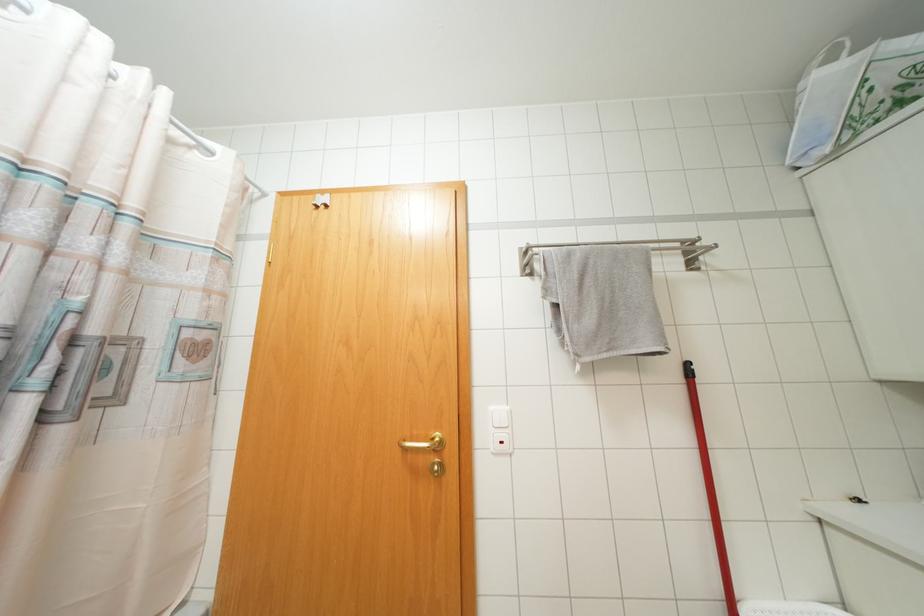
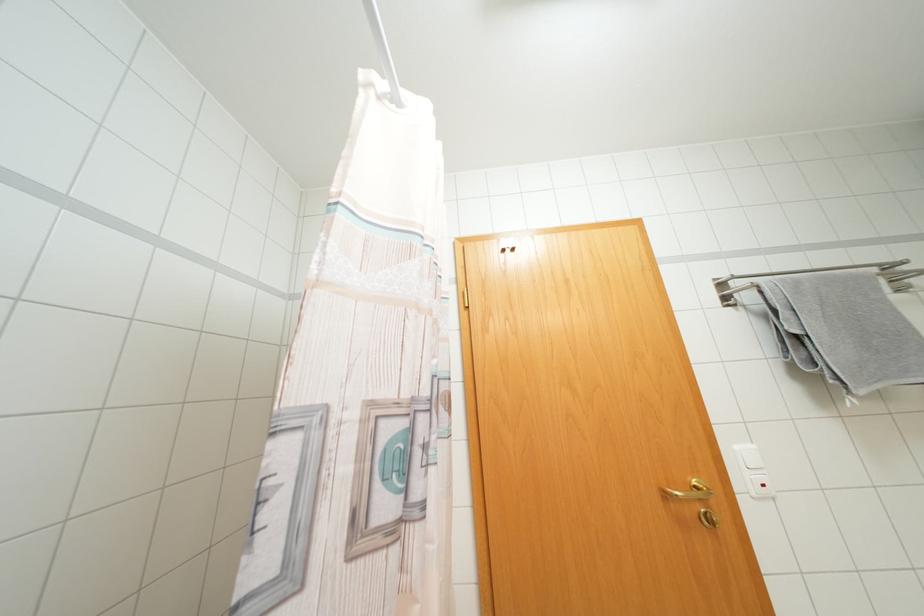
The point at (604, 355) is marked in the first image. Where is the corresponding point in the second image?

(877, 386)